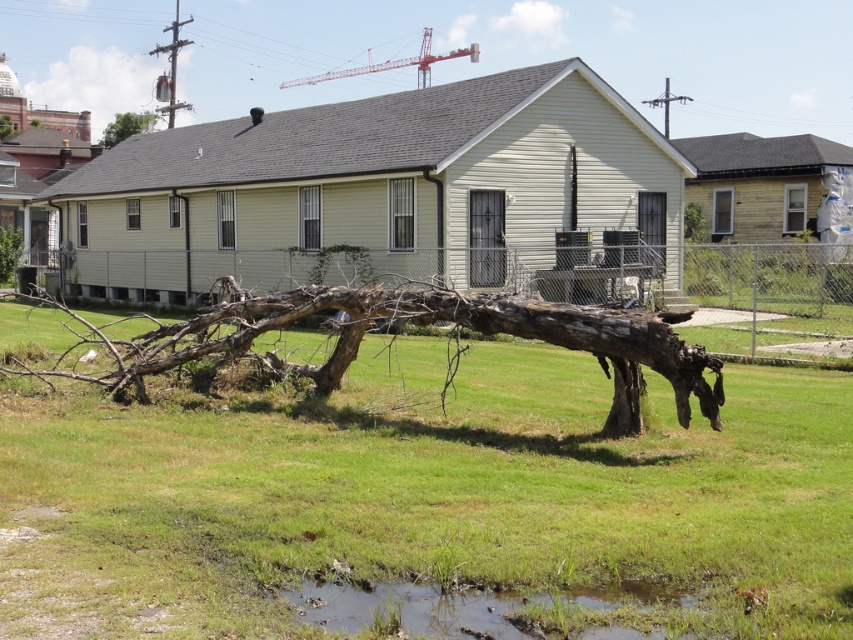
Question: Which object is closer to the camera taking this photo?

Choices:
 (A) brown rough tree trunk at lower left
 (B) green leafy tree at upper left
 (C) muddy wet grass at lower center
 (D) wooden fence at center

Answer: (C)

Question: Which point is farther to the camera?

Choices:
 (A) brown rough tree trunk at upper left
 (B) brown rough tree trunk at lower left
 (C) muddy wet grass at lower center

Answer: (A)

Question: Can you confirm if brown rough tree trunk at lower center is wider than green leafy tree at upper left?

Choices:
 (A) no
 (B) yes

Answer: (A)

Question: Which object is farther from the camera taking this photo?

Choices:
 (A) wooden fence at center
 (B) brown rough tree trunk at lower left
 (C) muddy wet grass at lower center
 (D) green leafy tree at upper left

Answer: (D)

Question: Can you confirm if wooden fence at center is positioned below green leafy tree at upper left?

Choices:
 (A) yes
 (B) no

Answer: (A)

Question: Does muddy wet grass at lower center have a larger size compared to green leafy tree at upper left?

Choices:
 (A) yes
 (B) no

Answer: (B)